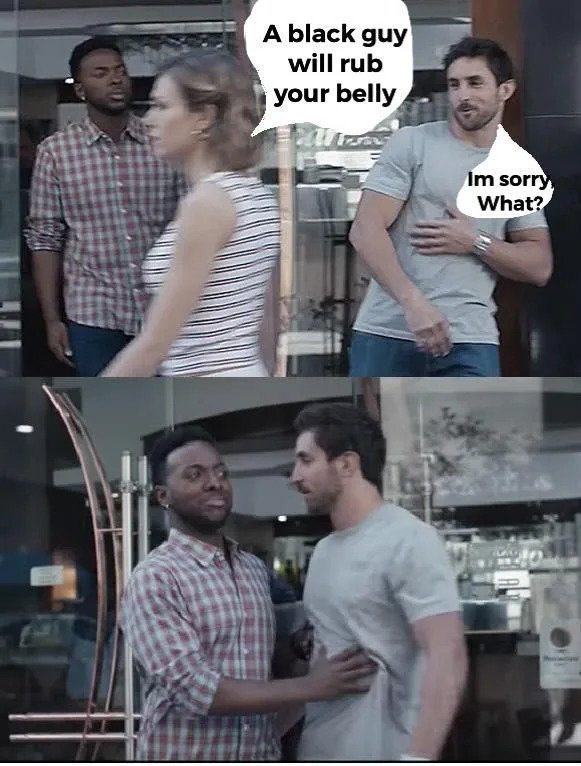
Identify the location of door handle. The image size is (581, 766). (120, 506), (120, 545), (87, 555).